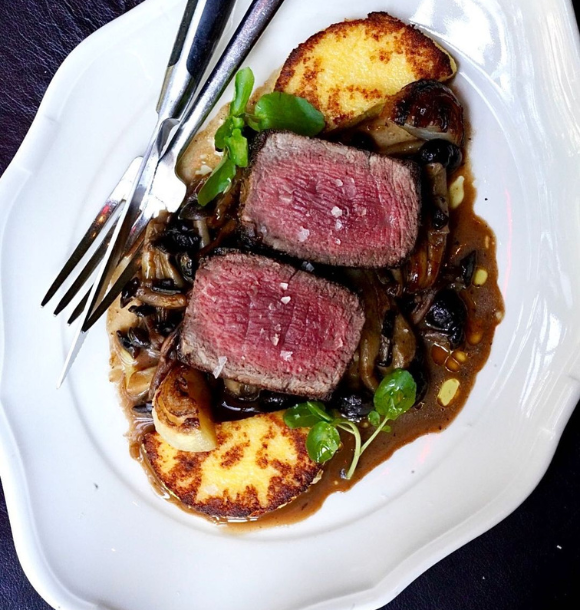
You are a GUI agent. You are given a task and a screenshot of the screen. Output one action in this format:
    pyautogui.click(x=<x>, y=<y>)
    Task: Click on the fork
    The width and height of the screenshot is (580, 610).
    Given the screenshot: What is the action you would take?
    pyautogui.click(x=166, y=184)